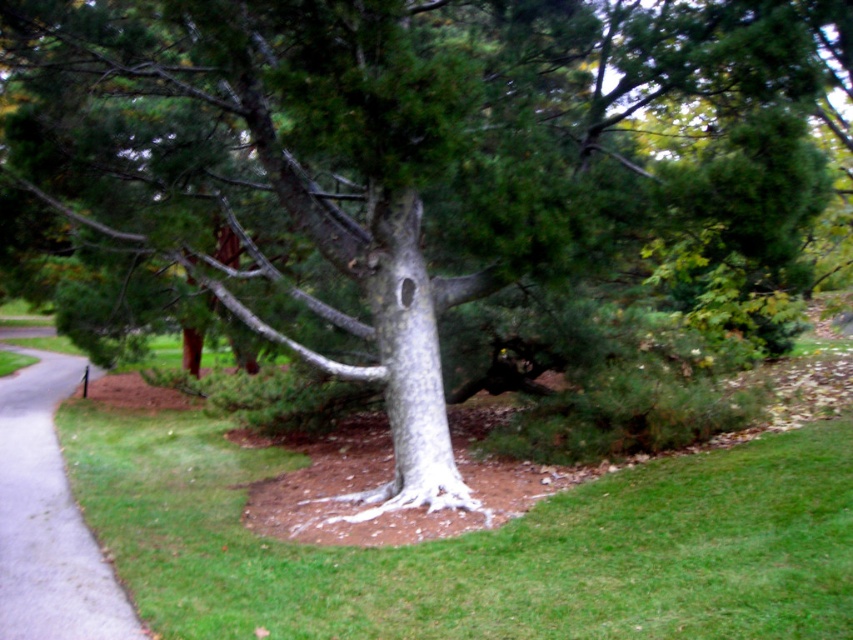
Does gray asphalt pavement at lower left have a larger size compared to white textured bark at center?

Yes.

Measure the distance from gray asphalt pavement at lower left to white textured bark at center.

gray asphalt pavement at lower left and white textured bark at center are 3.84 meters apart from each other.

At what (x,y) coordinates should I click in order to perform the action: click on gray asphalt pavement at lower left. Please return your answer as a coordinate pair (x, y). The height and width of the screenshot is (640, 853). Looking at the image, I should click on (48, 520).